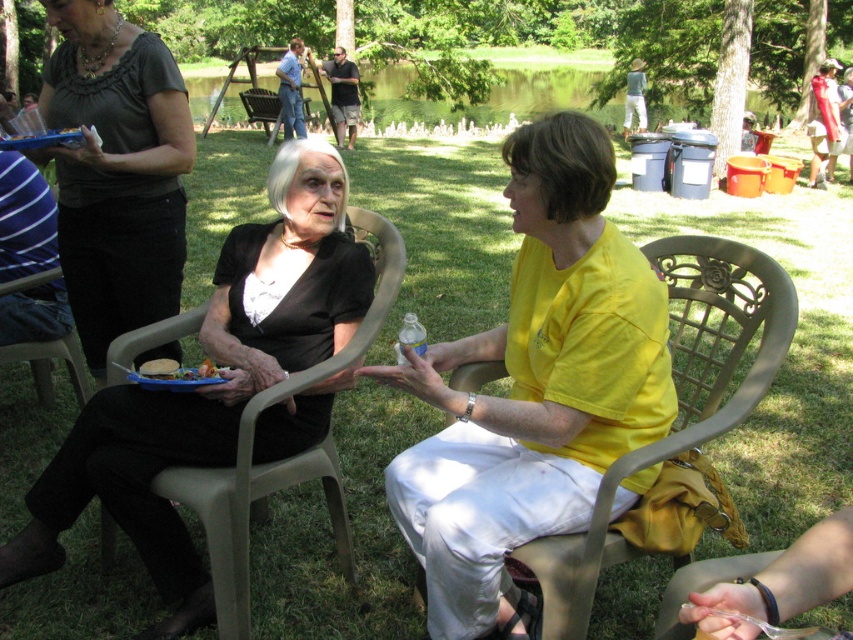
Question: Which is farther from the plastic chair at center?

Choices:
 (A) beige plastic chair at center
 (B) matte plastic plate at lower left
 (C) white matte bread at center

Answer: (A)

Question: Does plastic chair at lower left have a smaller size compared to matte plastic plate at lower left?

Choices:
 (A) no
 (B) yes

Answer: (A)

Question: Which of the following is the closest to the observer?

Choices:
 (A) beige plastic chair at center
 (B) white matte bread at center
 (C) plastic chair at center

Answer: (A)

Question: Considering the real-world distances, which object is farthest from the matte plastic plate at lower left?

Choices:
 (A) white matte bread at center
 (B) yellow matte shirt at center
 (C) brown plastic chair at center
 (D) plastic chair at center

Answer: (C)

Question: In this image, where is matte black dress at left located relative to plastic chair at lower left?

Choices:
 (A) above
 (B) below

Answer: (A)

Question: Where is plastic chair at lower left located in relation to white matte bread at center in the image?

Choices:
 (A) above
 (B) below

Answer: (A)